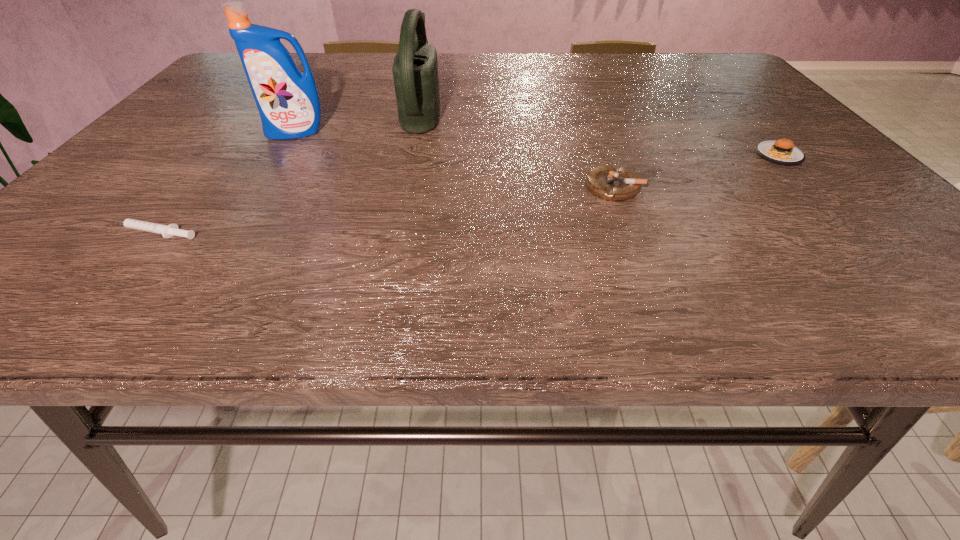
Where is `object that is the nearest to the shortest object`? The height and width of the screenshot is (540, 960). object that is the nearest to the shortest object is located at coordinates (288, 102).

Identify the location of object that stands as the second closest to the nearest object. This screenshot has width=960, height=540. (415, 68).

Locate an element on the screen. free space that satisfies the following two spatial constraints: 1. on the spout of the second object from right to left; 2. on the left side of the second tallest object is located at coordinates (406, 187).

Locate an element on the screen. This screenshot has width=960, height=540. vacant space that satisfies the following two spatial constraints: 1. on the spout of the fourth shortest object; 2. on the right side of the food is located at coordinates (413, 156).

Locate an element on the screen. This screenshot has height=540, width=960. vacant space that satisfies the following two spatial constraints: 1. on the spout of the watering can; 2. on the label of the detergent is located at coordinates (418, 132).

This screenshot has width=960, height=540. Identify the location of vacant position in the image that satisfies the following two spatial constraints: 1. on the label of the fourth object from left to right; 2. on the left side of the detergent. (263, 187).

Image resolution: width=960 pixels, height=540 pixels. In order to click on blank space that satisfies the following two spatial constraints: 1. on the label of the rightmost object; 2. on the right side of the detergent in this screenshot , I will do `click(282, 156)`.

Find the location of a particular element. The width and height of the screenshot is (960, 540). free spot that satisfies the following two spatial constraints: 1. on the spout of the food; 2. on the right side of the second tallest object is located at coordinates (413, 156).

At what (x,y) coordinates should I click in order to perform the action: click on vacant area that satisfies the following two spatial constraints: 1. on the back side of the second nearest object; 2. on the spout of the second tallest object. Please return your answer as a coordinate pair (x, y). Image resolution: width=960 pixels, height=540 pixels. Looking at the image, I should click on (585, 110).

Find the location of a particular element. vacant point that satisfies the following two spatial constraints: 1. on the spout of the third object from right to left; 2. on the label of the detergent is located at coordinates (418, 132).